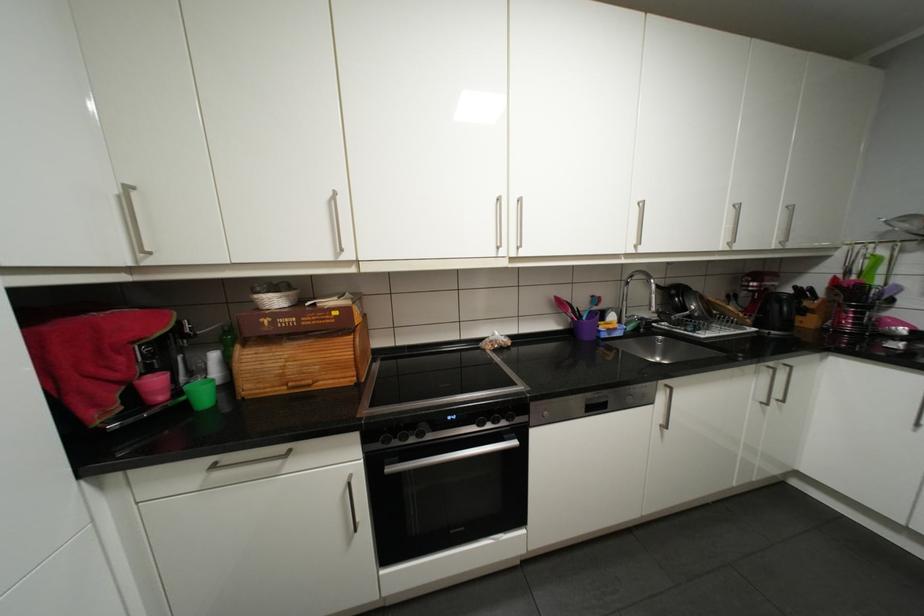
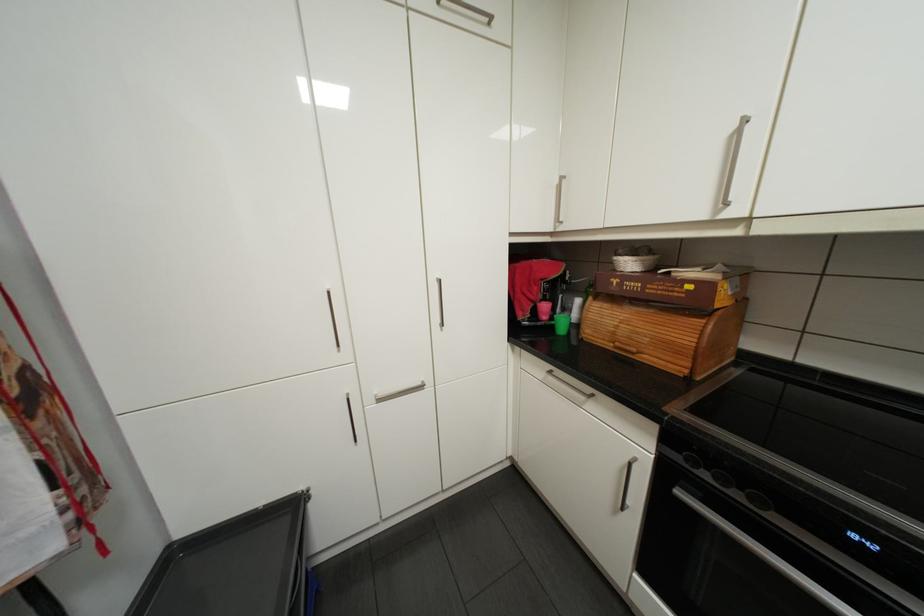
Where in the second image is the point corresponding to (x=403, y=442) from the first image?

(712, 474)